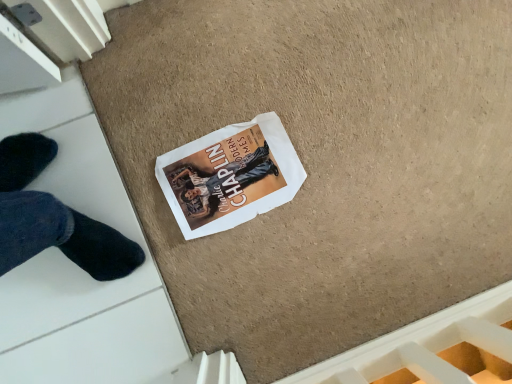
Where is `blank area beneath white paper magazine at center (from a real-world perspective)`? This screenshot has height=384, width=512. blank area beneath white paper magazine at center (from a real-world perspective) is located at coordinates (234, 180).